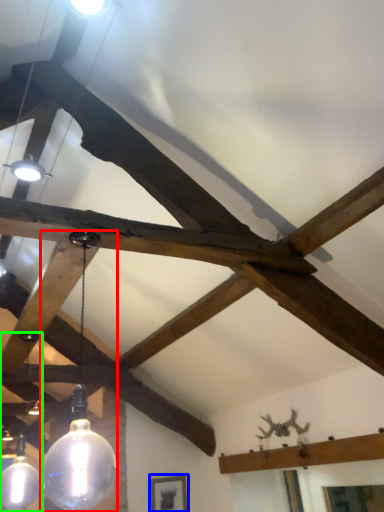
Question: Which object is positioned closest to lamp (highlighted by a red box)? Select from picture frame (highlighted by a blue box) and lamp (highlighted by a green box).

Choices:
 (A) picture frame
 (B) lamp

Answer: (B)